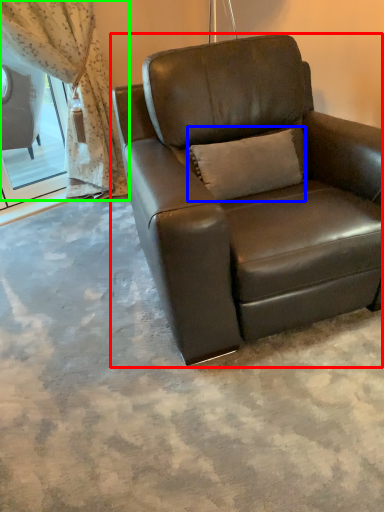
Question: Based on their relative distances, which object is farther from chair (highlighted by a red box)? Choose from pillow (highlighted by a blue box) and curtain (highlighted by a green box).

Choices:
 (A) pillow
 (B) curtain

Answer: (B)